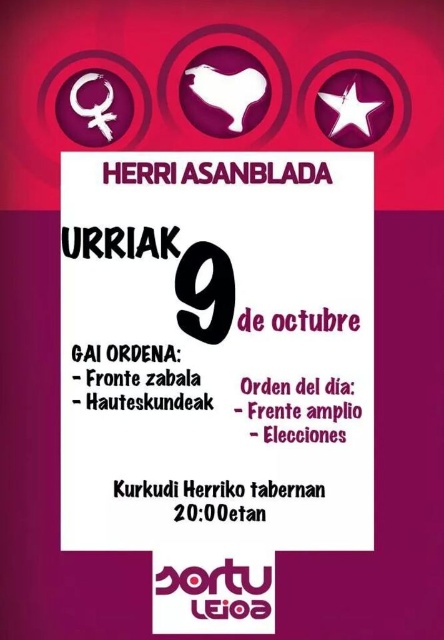
Question: Which object appears farthest from the camera in this image?

Choices:
 (A) white paper sign at center
 (B) black paper number at center

Answer: (B)

Question: Considering the relative positions of white paper sign at center and black paper number at center in the image provided, where is white paper sign at center located with respect to black paper number at center?

Choices:
 (A) right
 (B) left

Answer: (A)

Question: Can you confirm if white paper sign at center is positioned above black paper number at center?

Choices:
 (A) no
 (B) yes

Answer: (A)

Question: Among these objects, which one is nearest to the camera?

Choices:
 (A) white paper sign at center
 (B) black paper number at center

Answer: (A)

Question: Is white paper sign at center bigger than black paper number at center?

Choices:
 (A) yes
 (B) no

Answer: (A)